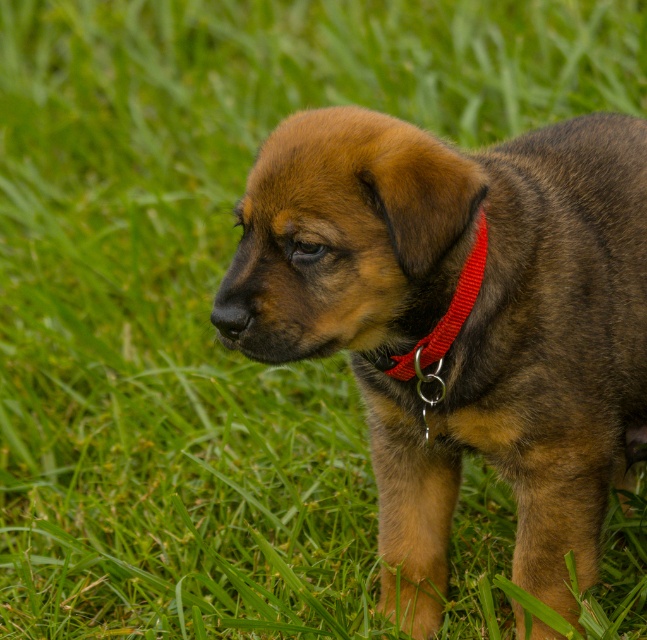
Between point (250, 312) and point (428, 348), which one is positioned behind?

Positioned behind is point (428, 348).

This screenshot has height=640, width=647. What do you see at coordinates (463, 323) in the screenshot?
I see `brown fur dog at center` at bounding box center [463, 323].

This screenshot has width=647, height=640. Identify the location of brown fur dog at center. (463, 323).